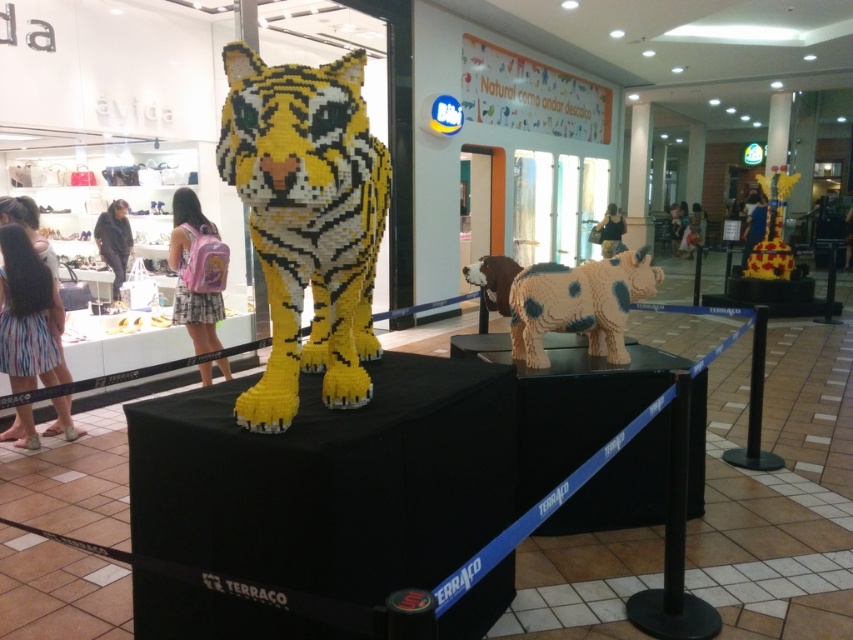
You are a photographer setting up a shot of the LEGO tiger and cow display. You need to focus on the point closer to the camera between the two points marked as point 1 at (341, 321) and point 2 at (616, 296). Which point should you focus on?

You should focus on point 1 at (341, 321) because it is closer to the camera than point 2 at (616, 296).

You are a customer standing in front of the LEGO display. You want to place a new LEGO giraffe between the yellow lego tiger at center and the speckled plastic cow at center. Can you fit it there without moving either existing sculptures?

The yellow lego tiger at center is to the left of the speckled plastic cow at center, so there is space between them to place the new LEGO giraffe without moving either existing sculptures.